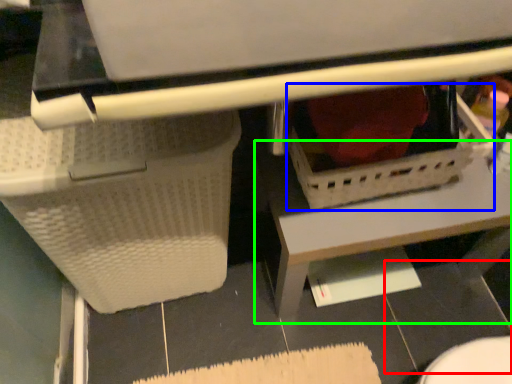
Question: Based on their relative distances, which object is nearer to tile (highlighted by a red box)? Choose from basket (highlighted by a blue box) and table (highlighted by a green box).

Choices:
 (A) basket
 (B) table

Answer: (B)